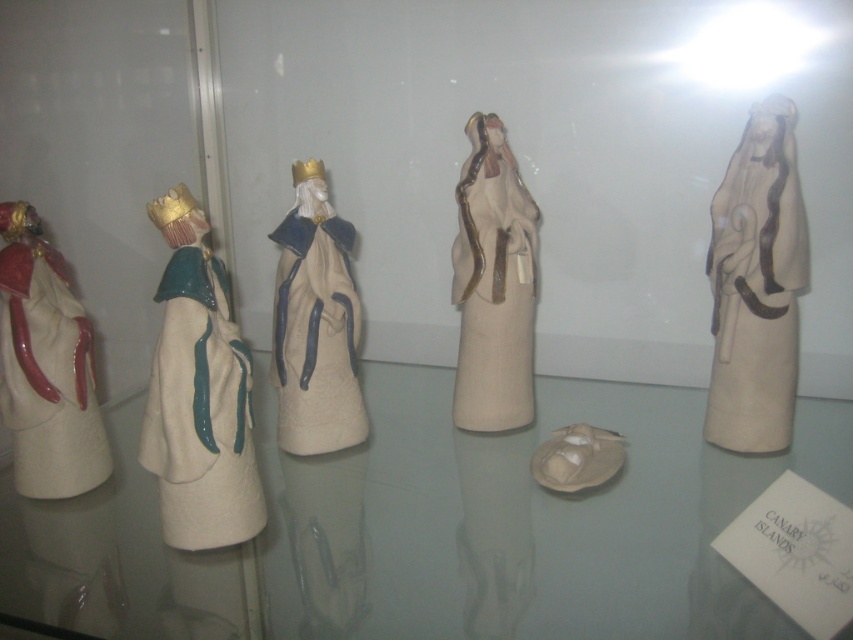
You are standing in front of a display case with a transparent glass table at center and a matte beige figurine at center. Which object is closer to you?

The transparent glass table at center is closer to the viewer than the matte beige figurine at center.

You are an interior designer assessing the display case. You need to determine which of the two central figurines, the matte beige figurine at center or the matte white porcelain figurine at center, is taller. Based on the scene description, which one is taller?

The matte beige figurine at center is taller than the matte white porcelain figurine at center according to the description.